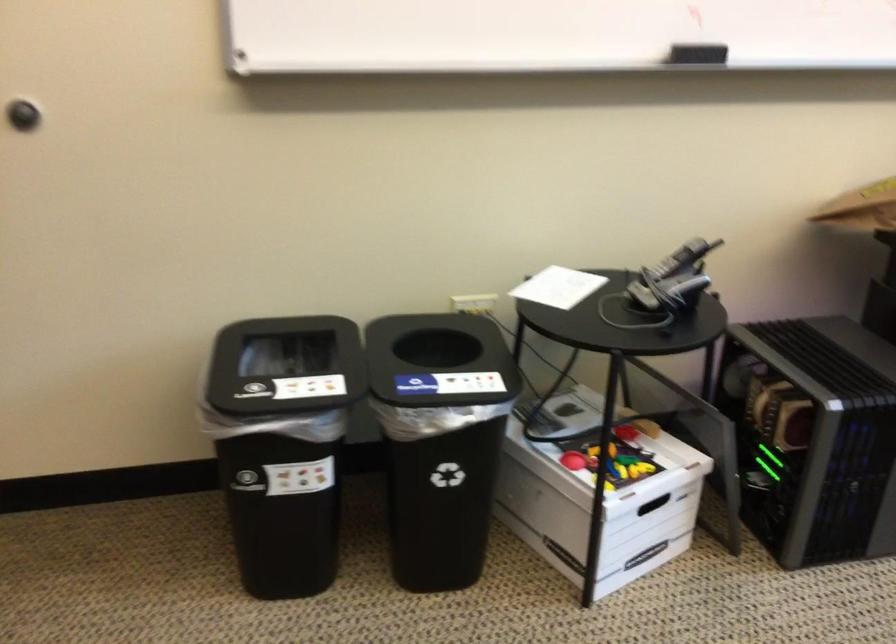
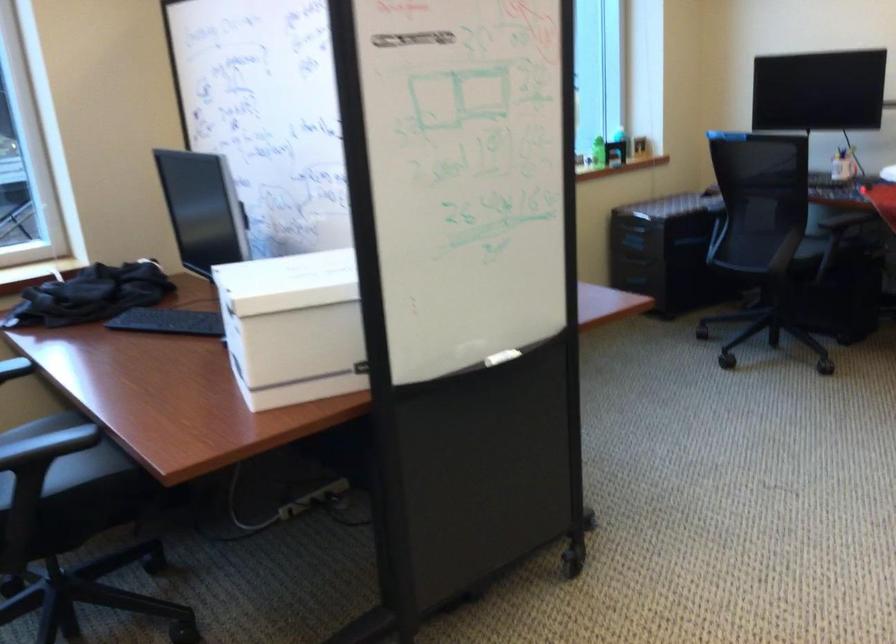
How did the camera likely rotate?

The camera's rotation is toward right-down.